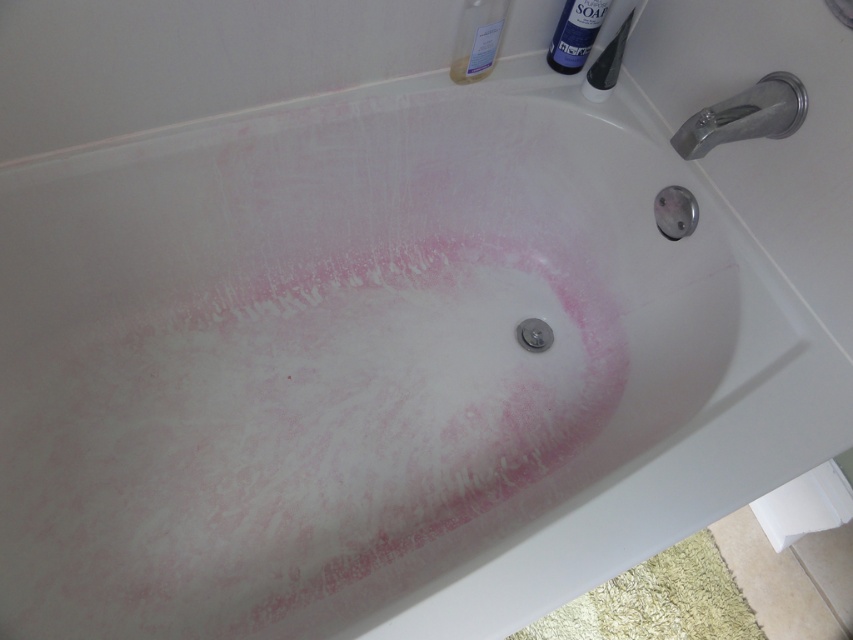
You are a bathroom inspector checking the bathtub. You notice two points marked on the bathtub surface. The first point is at coordinate point (706, 109) and the second at point (582, 42). Which point is closer to you as you inspect from the front?

Point (706, 109) is closer to the camera than point (582, 42).